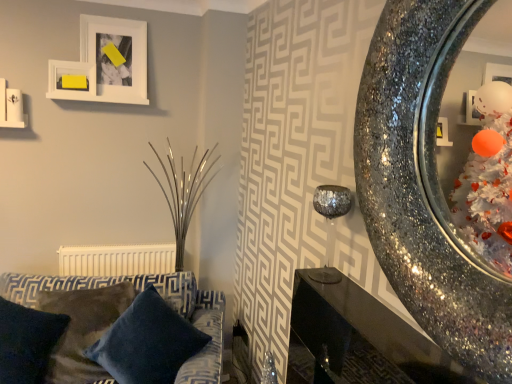
Where is `white matte radiator at lower left`? The width and height of the screenshot is (512, 384). white matte radiator at lower left is located at coordinates (116, 260).

Measure the distance between point (62,283) and camera.

The distance of point (62,283) from camera is 2.21 meters.

This screenshot has width=512, height=384. Describe the element at coordinates (137, 293) in the screenshot. I see `velvet blue couch at lower left` at that location.

The width and height of the screenshot is (512, 384). I want to click on shiny metallic table at lower right, so [359, 339].

The image size is (512, 384). What do you see at coordinates (330, 224) in the screenshot? I see `sparkly metallic candle holder at upper right` at bounding box center [330, 224].

This screenshot has height=384, width=512. Identify the location of velvety dark blue pillow at lower left. (27, 342).

What are the coordinates of `white matte radiator at lower left` in the screenshot? It's located at (116, 260).

From a real-world perspective, between sparkly metallic candle holder at upper right and white matte radiator at lower left, who is vertically lower?

white matte radiator at lower left is physically lower.

Is the surface of sparkly metallic candle holder at upper right in direct contact with white matte radiator at lower left?

No, sparkly metallic candle holder at upper right is not in contact with white matte radiator at lower left.

From the image's perspective, which one is positioned higher, sparkly metallic candle holder at upper right or white matte radiator at lower left?

sparkly metallic candle holder at upper right appears higher in the image.

Consider the image. Does velvet blue couch at lower left appear on the left side of shiny metallic table at lower right?

Indeed, velvet blue couch at lower left is positioned on the left side of shiny metallic table at lower right.

Is velvet blue couch at lower left outside of shiny metallic table at lower right?

Absolutely, velvet blue couch at lower left is external to shiny metallic table at lower right.

Is velvet blue couch at lower left further to camera compared to shiny metallic table at lower right?

Yes, velvet blue couch at lower left is further from the camera.

Is shiny metallic table at lower right inside sparkly metallic candle holder at upper right?

No, shiny metallic table at lower right is not surrounded by sparkly metallic candle holder at upper right.

Considering the sizes of objects sparkly metallic candle holder at upper right and shiny metallic table at lower right in the image provided, who is shorter, sparkly metallic candle holder at upper right or shiny metallic table at lower right?

Standing shorter between the two is shiny metallic table at lower right.

Considering the positions of point (325, 267) and point (310, 308), is point (325, 267) closer or farther from the camera than point (310, 308)?

Point (325, 267).

Is velvet blue couch at lower left completely or partially outside of yellow paper at upper left, which is the 2th picture frame in right-to-left order?

Absolutely, velvet blue couch at lower left is external to yellow paper at upper left, which is the 2th picture frame in right-to-left order.

How many degrees apart are the facing directions of velvet blue couch at lower left and yellow paper at upper left, acting as the 1th picture frame starting from the left?

velvet blue couch at lower left and yellow paper at upper left, acting as the 1th picture frame starting from the left, are facing 16.8 degrees away from each other.

Is velvet blue couch at lower left facing towards yellow paper at upper left, which is the 2th picture frame in right-to-left order?

No, velvet blue couch at lower left does not turn towards yellow paper at upper left, which is the 2th picture frame in right-to-left order.

Which object is further away from the camera, velvet blue couch at lower left or yellow paper at upper left, acting as the 1th picture frame starting from the left?

yellow paper at upper left, acting as the 1th picture frame starting from the left, is behind.

Based on their positions, is white matte picture frame at upper left, arranged as the 2th picture frame when viewed from the left, located to the left or right of velvety dark blue pillow at lower left?

white matte picture frame at upper left, arranged as the 2th picture frame when viewed from the left, is to the right of velvety dark blue pillow at lower left.

Which object is thinner, white matte picture frame at upper left, the first picture frame in the right-to-left sequence, or velvety dark blue pillow at lower left?

white matte picture frame at upper left, the first picture frame in the right-to-left sequence, is thinner.

Which is in front, point (120, 58) or point (40, 334)?

The point (40, 334) is closer to the camera.

Would you say velvet blue couch at lower left is a long distance from white matte radiator at lower left?

velvet blue couch at lower left is near white matte radiator at lower left, not far away.

Between velvet blue couch at lower left and white matte radiator at lower left, which one has smaller width?

white matte radiator at lower left is thinner.

Is velvet blue couch at lower left turned away from white matte radiator at lower left?

Correct, velvet blue couch at lower left is looking away from white matte radiator at lower left.

Can you tell me how much velvet blue couch at lower left and white matte radiator at lower left differ in facing direction?

velvet blue couch at lower left and white matte radiator at lower left are facing 15.5 degrees away from each other.

Locate an element on the screen. This screenshot has width=512, height=384. studio couch behind the sparkly metallic mirror at right is located at coordinates (137, 293).

From a real-world perspective, is sparkly metallic mirror at right physically located above or below velvet blue couch at lower left?

sparkly metallic mirror at right is situated higher than velvet blue couch at lower left in the real world.

The height and width of the screenshot is (384, 512). What are the coordinates of `candle holder that appears on the right of white matte radiator at lower left` in the screenshot? It's located at (330, 224).

Locate an element on the screen. The height and width of the screenshot is (384, 512). studio couch behind the shiny metallic table at lower right is located at coordinates (137, 293).

When comparing their distances from shiny metallic table at lower right, does velvety dark blue pillow at lower left or velvet blue couch at lower left seem closer?

The object closer to shiny metallic table at lower right is velvet blue couch at lower left.

Considering their positions, is shiny metallic table at lower right positioned further to sparkly metallic candle holder at upper right than sparkly metallic mirror at right?

sparkly metallic mirror at right.

Looking at the image, which one is located further to velvety dark blue pillow at lower left, sparkly metallic mirror at right or velvet blue couch at lower left?

The object further to velvety dark blue pillow at lower left is sparkly metallic mirror at right.

Estimate the real-world distances between objects in this image. Which object is further from sparkly metallic candle holder at upper right, white matte picture frame at upper left, the first picture frame in the right-to-left sequence, or shiny metallic table at lower right?

Among the two, white matte picture frame at upper left, the first picture frame in the right-to-left sequence, is located further to sparkly metallic candle holder at upper right.

When comparing their distances from white matte picture frame at upper left, arranged as the 2th picture frame when viewed from the left, does sparkly metallic candle holder at upper right or velvety dark blue pillow at lower left seem closer?

Among the two, velvety dark blue pillow at lower left is located nearer to white matte picture frame at upper left, arranged as the 2th picture frame when viewed from the left.

Considering their positions, is sparkly metallic mirror at right positioned closer to velvet blue couch at lower left than white matte radiator at lower left?

white matte radiator at lower left is positioned closer to the anchor velvet blue couch at lower left.

From the image, which object appears to be farther from white matte radiator at lower left, sparkly metallic mirror at right or yellow paper at upper left, acting as the 1th picture frame starting from the left?

sparkly metallic mirror at right is further to white matte radiator at lower left.

When comparing their distances from sparkly metallic mirror at right, does yellow paper at upper left, acting as the 1th picture frame starting from the left, or white matte radiator at lower left seem further?

The object further to sparkly metallic mirror at right is white matte radiator at lower left.

You are a GUI agent. You are given a task and a screenshot of the screen. Output one action in this format:
    pyautogui.click(x=<x>, y=<y>)
    Task: Click on the candle holder located between sparkly metallic mirror at right and white matte radiator at lower left in the depth direction
    Image resolution: width=512 pixels, height=384 pixels.
    Given the screenshot: What is the action you would take?
    click(330, 224)

At what (x,y) coordinates should I click in order to perform the action: click on round table between white matte picture frame at upper left, the first picture frame in the right-to-left sequence, and velvety dark blue pillow at lower left vertically. Please return your answer as a coordinate pair (x, y). Image resolution: width=512 pixels, height=384 pixels. Looking at the image, I should click on (359, 339).

At what (x,y) coordinates should I click in order to perform the action: click on studio couch between velvety dark blue pillow at lower left and sparkly metallic candle holder at upper right in the horizontal direction. Please return your answer as a coordinate pair (x, y). The width and height of the screenshot is (512, 384). Looking at the image, I should click on (137, 293).

Find the location of `radiator between white matte picture frame at upper left, the first picture frame in the right-to-left sequence, and velvet blue couch at lower left from top to bottom`. radiator between white matte picture frame at upper left, the first picture frame in the right-to-left sequence, and velvet blue couch at lower left from top to bottom is located at coordinates (116, 260).